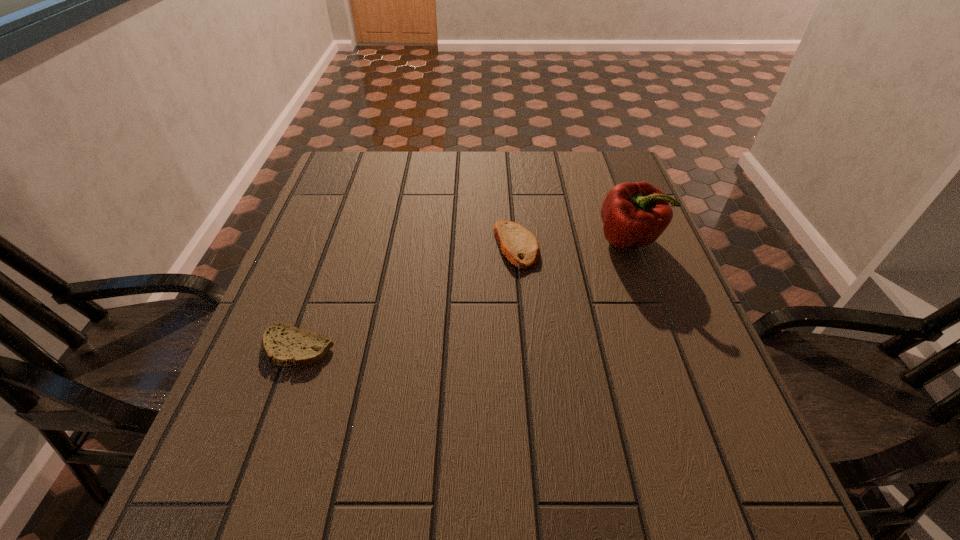
I want to click on the rightmost object, so click(637, 213).

The width and height of the screenshot is (960, 540). I want to click on the tallest object, so click(637, 213).

You are a GUI agent. You are given a task and a screenshot of the screen. Output one action in this format:
    pyautogui.click(x=<x>, y=<y>)
    Task: Click on the second tallest object
    The height and width of the screenshot is (540, 960).
    Given the screenshot: What is the action you would take?
    pyautogui.click(x=520, y=246)

Locate an element on the screen. Image resolution: width=960 pixels, height=540 pixels. the taller pita bread is located at coordinates click(x=520, y=246).

This screenshot has height=540, width=960. What are the coordinates of `the left pita bread` in the screenshot? It's located at (284, 345).

Find the location of a particular element. The height and width of the screenshot is (540, 960). the shortest object is located at coordinates (284, 345).

Identify the location of vacant space located on the front of the rightmost object. (645, 285).

This screenshot has width=960, height=540. I want to click on vacant space located on the left of the right pita bread, so click(x=383, y=246).

Where is `free space located 0.370m on the right of the nearer pita bread`? This screenshot has height=540, width=960. free space located 0.370m on the right of the nearer pita bread is located at coordinates (517, 348).

The width and height of the screenshot is (960, 540). What are the coordinates of `object at the left edge` in the screenshot? It's located at (284, 345).